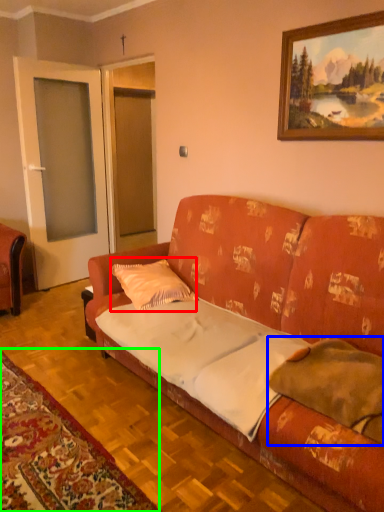
Question: Which is farther away from pillow (highlighted by a red box)? pillow (highlighted by a blue box) or mat (highlighted by a green box)?

Choices:
 (A) pillow
 (B) mat

Answer: (A)